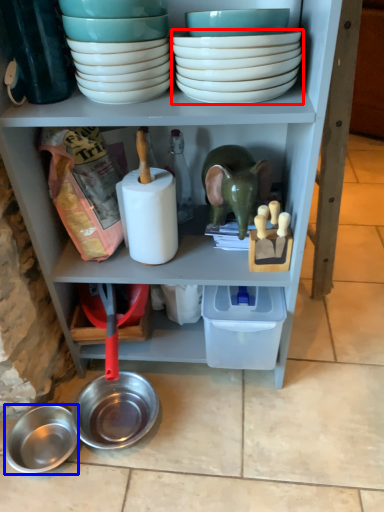
Question: Which object appears closest to the camera in this image, bowl (highlighted by a red box) or bowl (highlighted by a blue box)?

Choices:
 (A) bowl
 (B) bowl

Answer: (A)